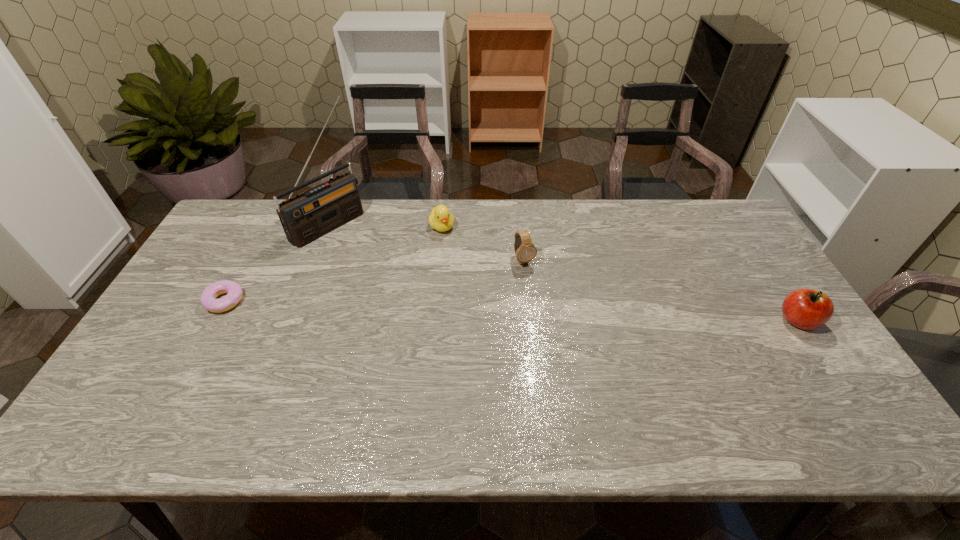
You are a GUI agent. You are given a task and a screenshot of the screen. Output one action in this format:
    pyautogui.click(x=<x>, y=<y>)
    Task: Click on the duckling positioned at the far edge
    
    Given the screenshot: What is the action you would take?
    pyautogui.click(x=440, y=219)

At what (x,y) coordinates should I click in order to perform the action: click on radio receiver positioned at the far edge. Please return your answer as a coordinate pair (x, y). This screenshot has height=540, width=960. Looking at the image, I should click on (306, 217).

You are a GUI agent. You are given a task and a screenshot of the screen. Output one action in this format:
    pyautogui.click(x=<x>, y=<y>)
    Task: Click on the object at the left edge
    The height and width of the screenshot is (540, 960).
    Given the screenshot: What is the action you would take?
    pyautogui.click(x=208, y=299)

In order to click on object situated at the right edge in this screenshot , I will do `click(807, 309)`.

What are the coordinates of `free space at the far edge` in the screenshot? It's located at (533, 222).

Find the location of `vacant space at the near edge of the desktop`. vacant space at the near edge of the desktop is located at coordinates (740, 374).

Find the location of a particular element. free spot at the right edge of the desktop is located at coordinates (765, 289).

Locate an element on the screen. The width and height of the screenshot is (960, 540). blank space at the far right corner is located at coordinates (704, 206).

The image size is (960, 540). I want to click on vacant space at the near right corner, so click(820, 373).

Locate an element on the screen. This screenshot has width=960, height=540. unoccupied position between the second object from right to left and the rightmost object is located at coordinates (661, 291).